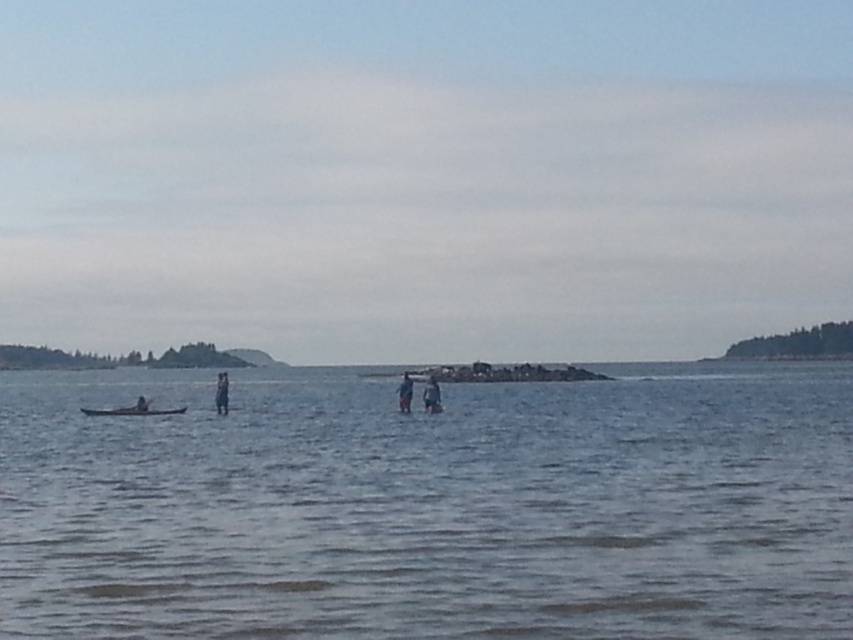
Who is lower down, clear water at center or smooth blue pants at center?

clear water at center is below.

Which of these two, clear water at center or smooth blue pants at center, stands shorter?

With less height is smooth blue pants at center.

Is point (697, 474) positioned before point (215, 396)?

Yes.

This screenshot has width=853, height=640. In order to click on clear water at center in this screenshot , I will do `click(428, 506)`.

Looking at this image, who is taller, smooth brown canoe at lower left or smooth wooden paddleboard at left?

Standing taller between the two is smooth brown canoe at lower left.

Is point (165, 413) less distant than point (138, 401)?

Yes, it is in front of point (138, 401).

Is point (138, 406) more distant than point (137, 404)?

No, it is in front of (137, 404).

At what (x,y) coordinates should I click in order to perform the action: click on smooth brown canoe at lower left. Please return your answer as a coordinate pair (x, y). This screenshot has height=640, width=853. Looking at the image, I should click on (132, 412).

Between smooth brown canoe at lower left and dark blue fabric at center, which one is positioned higher?

dark blue fabric at center

Find the location of a particular element. smooth brown canoe at lower left is located at coordinates (132, 412).

I want to click on smooth brown canoe at lower left, so tap(132, 412).